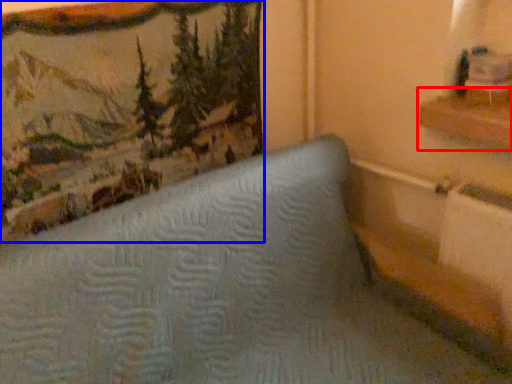
Question: Which object appears closest to the camera in this image, shelf (highlighted by a red box) or picture frame (highlighted by a blue box)?

Choices:
 (A) shelf
 (B) picture frame

Answer: (B)